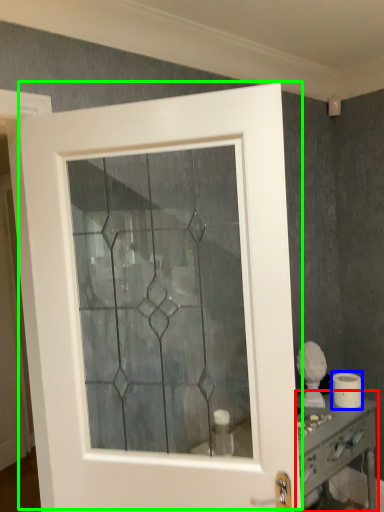
Question: Based on their relative distances, which object is nearer to vanity (highlighted by a red box)? Choose from toilet paper (highlighted by a blue box) and door (highlighted by a green box).

Choices:
 (A) toilet paper
 (B) door

Answer: (A)